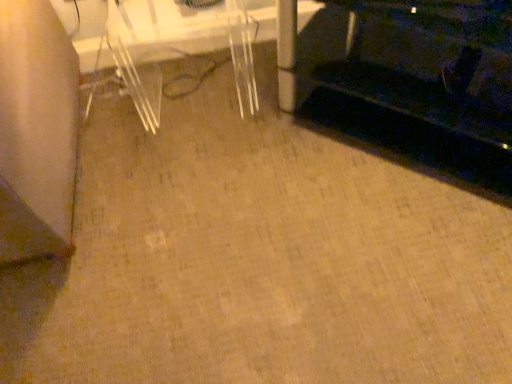
Question: Is black fabric couch at lower right inside or outside of clear plastic table at center?

Choices:
 (A) outside
 (B) inside

Answer: (A)

Question: From the image's perspective, is black fabric couch at lower right positioned above or below clear plastic table at center?

Choices:
 (A) above
 (B) below

Answer: (B)

Question: Considering the positions of black fabric couch at lower right and clear plastic table at center in the image, is black fabric couch at lower right taller or shorter than clear plastic table at center?

Choices:
 (A) short
 (B) tall

Answer: (B)

Question: In the image, is clear plastic table at center on the left side or the right side of black fabric couch at lower right?

Choices:
 (A) left
 (B) right

Answer: (A)

Question: In terms of height, does clear plastic table at center look taller or shorter compared to black fabric couch at lower right?

Choices:
 (A) short
 (B) tall

Answer: (A)

Question: Is clear plastic table at center bigger or smaller than black fabric couch at lower right?

Choices:
 (A) small
 (B) big

Answer: (A)

Question: Does point (123, 23) appear closer or farther from the camera than point (411, 155)?

Choices:
 (A) closer
 (B) farther

Answer: (B)